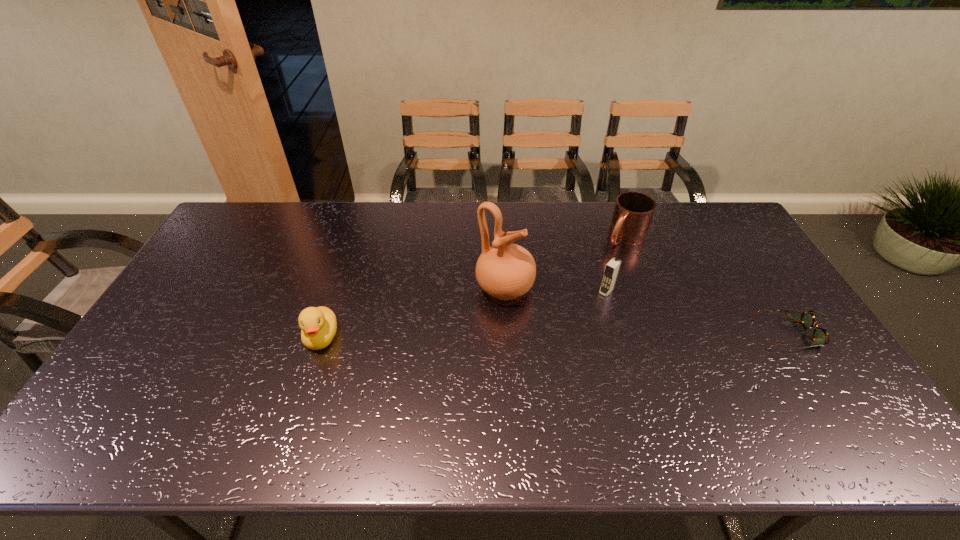
In order to click on vacant position located on the front-facing side of the spectacles in this screenshot , I will do `click(703, 334)`.

Where is `blank space located on the front-facing side of the spectacles`? The height and width of the screenshot is (540, 960). blank space located on the front-facing side of the spectacles is located at coordinates (732, 334).

I want to click on free space located 0.400m on the front-facing side of the spectacles, so click(618, 334).

Find the location of a particular element. Image resolution: width=960 pixels, height=540 pixels. vacant space located on the spout of the second object from left to right is located at coordinates (556, 314).

This screenshot has width=960, height=540. In order to click on vacant space located on the spout of the second object from left to right in this screenshot , I will do `click(660, 364)`.

This screenshot has height=540, width=960. Find the location of `vacant space located on the spout of the second object from left to right`. vacant space located on the spout of the second object from left to right is located at coordinates (553, 312).

In order to click on free space located 0.210m on the side of the second object from right to left with the handle in this screenshot , I will do `click(584, 281)`.

You are a GUI agent. You are given a task and a screenshot of the screen. Output one action in this format:
    pyautogui.click(x=<x>, y=<y>)
    Task: Click on the free space located on the side of the second object from right to left with the handle
    Image resolution: width=960 pixels, height=540 pixels.
    Given the screenshot: What is the action you would take?
    pyautogui.click(x=590, y=274)

Locate an element on the screen. free space located 0.350m on the side of the second object from right to left with the handle is located at coordinates (560, 306).

You are a GUI agent. You are given a task and a screenshot of the screen. Output one action in this format:
    pyautogui.click(x=<x>, y=<y>)
    Task: Click on the free space located 0.060m on the front-facing side of the third object from left to right
    The height and width of the screenshot is (540, 960).
    Given the screenshot: What is the action you would take?
    pyautogui.click(x=592, y=307)